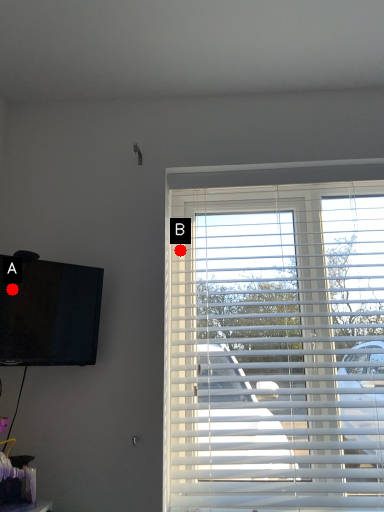
Question: Two points are circled on the image, labeled by A and B beside each circle. Which point appears closest to the camera in this image?

Choices:
 (A) A is closer
 (B) B is closer

Answer: (A)